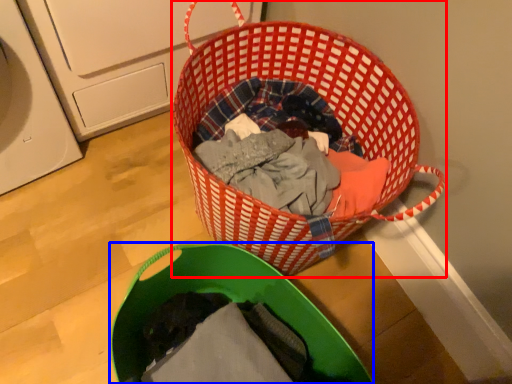
Question: Which object appears closest to the camera in this image, picnic basket (highlighted by a red box) or laundry basket (highlighted by a blue box)?

Choices:
 (A) picnic basket
 (B) laundry basket

Answer: (B)